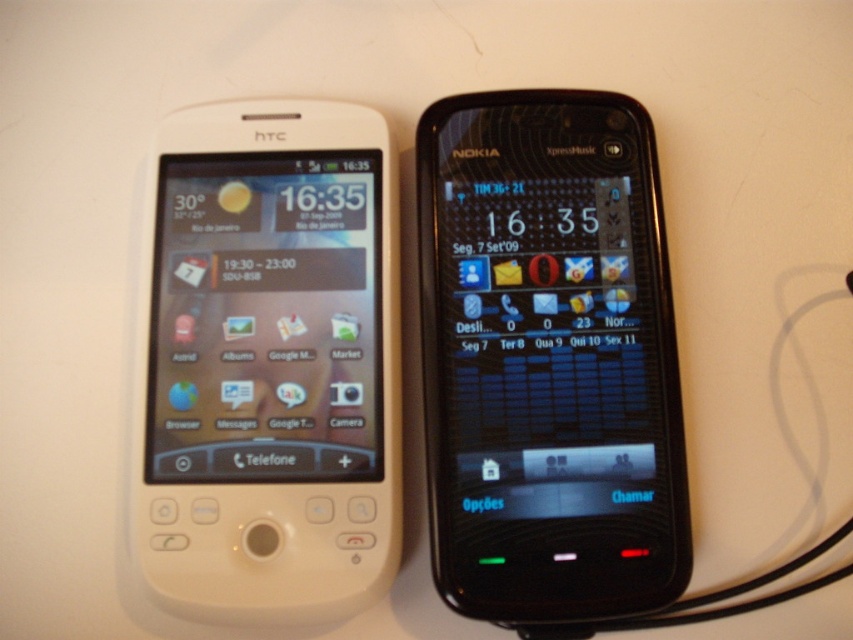
You are a delivery person who needs to place a small package between the HTC phone on the left and the black glossy nokia phone at center. The package is 30 inches long. Will it fit between them?

The distance between the HTC phone on the left and the black glossy nokia phone at center is 38.61 inches. Since the package is 30 inches long, it will fit between them as there is enough space.

You are a delivery person who needs to locate the black glossy nokia phone at center in the image. According to the coordinates provided, where exactly should you look to find it?

The black glossy nokia phone at center is located at point coordinates of (549, 358).